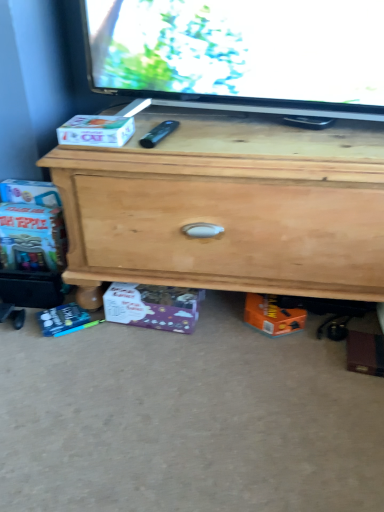
Question: Is purple cardboard box at lower center, positioned as the 2th box in top-to-bottom order, taller or shorter than natural wood chest of drawers at center?

Choices:
 (A) short
 (B) tall

Answer: (A)

Question: In terms of size, does purple cardboard box at lower center, positioned as the 2th box in top-to-bottom order, appear bigger or smaller than natural wood chest of drawers at center?

Choices:
 (A) big
 (B) small

Answer: (B)

Question: Based on their relative distances, which object is farther from the white cardboard box at left, which is the 1th box from front to back?

Choices:
 (A) natural wood chest of drawers at center
 (B) purple cardboard box at lower center, positioned as the 2th box in top-to-bottom order

Answer: (B)

Question: Which object is the farthest from the purple cardboard box at lower center, positioned as the 1th box in bottom-to-top order?

Choices:
 (A) white cardboard box at left, the 1th box in the top-to-bottom sequence
 (B) natural wood chest of drawers at center

Answer: (A)